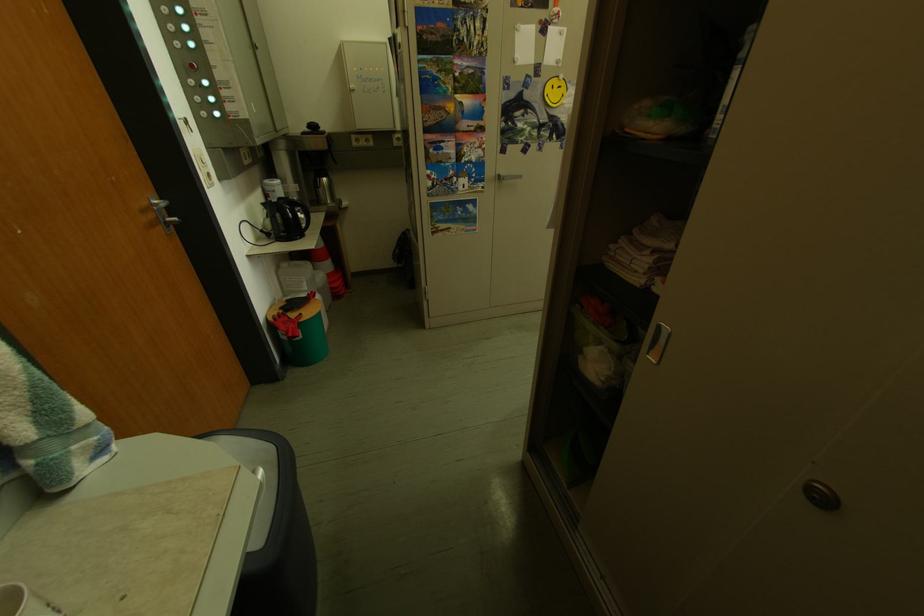
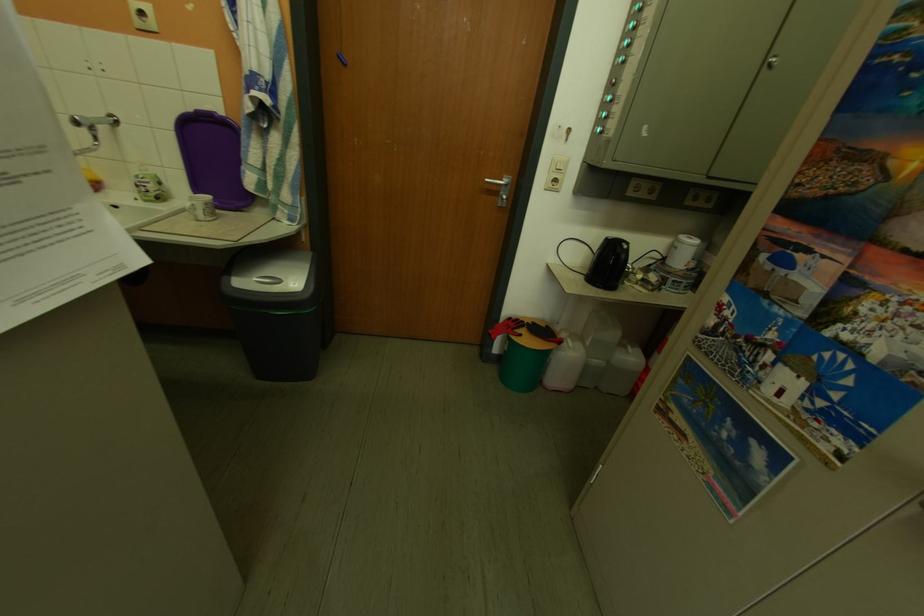
Find the pixel in the second image that matches the point at 318,291 in the first image.

(602, 346)